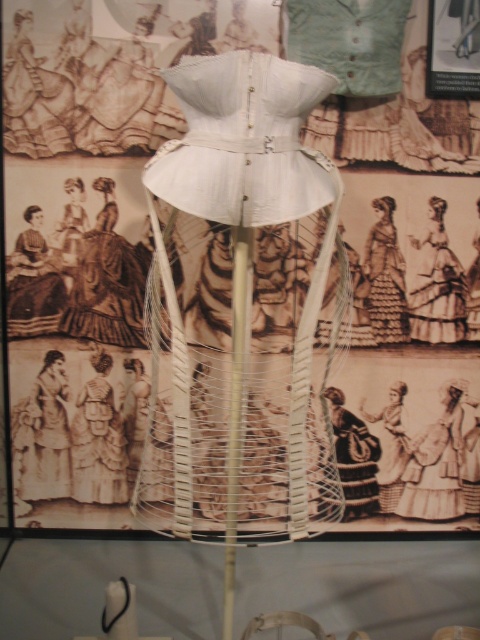
Question: Is brown textured dress at center smaller than dark brown fabric dress at center?

Choices:
 (A) yes
 (B) no

Answer: (B)

Question: Observing the image, what is the correct spatial positioning of light beige fabric dress at lower left in reference to silk taffeta dress at center?

Choices:
 (A) below
 (B) above

Answer: (A)

Question: Can you confirm if dark gray fabric dress at center is positioned below white cotton dress at center?

Choices:
 (A) yes
 (B) no

Answer: (A)

Question: Which point appears farthest from the camera in this image?

Choices:
 (A) 23,298
 (B) 462,438
 (C) 62,365

Answer: (B)

Question: Which point is farther from the camera taking this photo?

Choices:
 (A) (415, 452)
 (B) (364, 506)

Answer: (B)

Question: Based on their relative distances, which object is farther from the dark brown fabric dress at center?

Choices:
 (A) black textured fabric dress at center
 (B) light beige fabric dress at lower left

Answer: (A)